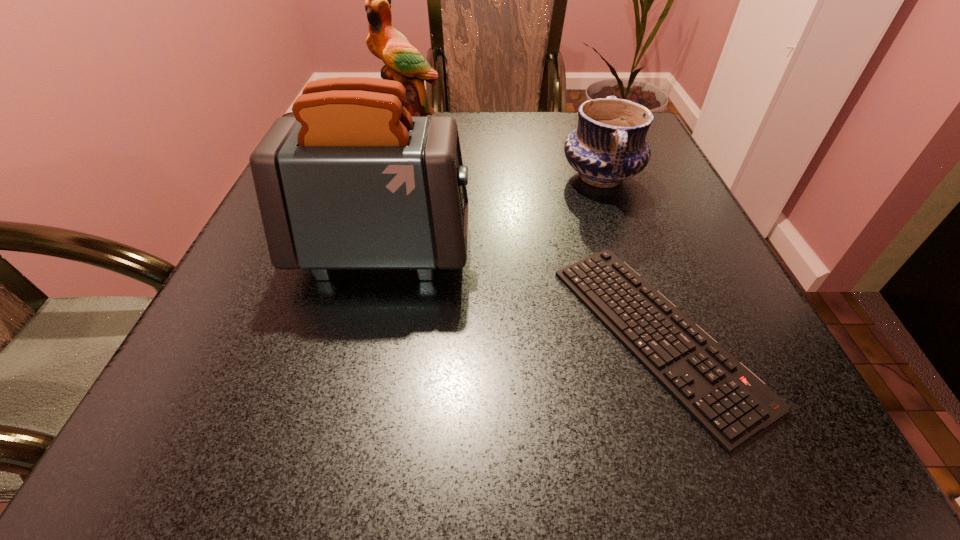
The width and height of the screenshot is (960, 540). Identify the location of pottery present at the far edge. (608, 146).

I want to click on object that is at the near edge, so click(731, 403).

The width and height of the screenshot is (960, 540). Find the location of `parrot that is at the left edge`. parrot that is at the left edge is located at coordinates (404, 63).

I want to click on toaster that is at the left edge, so click(352, 182).

You are a GUI agent. You are given a task and a screenshot of the screen. Output one action in this format:
    pyautogui.click(x=<x>, y=<y>)
    Task: Click on the pottery located at the right edge
    
    Given the screenshot: What is the action you would take?
    pyautogui.click(x=608, y=146)

I want to click on computer keyboard situated at the right edge, so click(731, 403).

Identify the location of object located at the far left corner. (404, 63).

The image size is (960, 540). Identify the location of object that is at the far right corner. (608, 146).

Locate an element on the screen. object that is positioned at the near right corner is located at coordinates (731, 403).

Where is `vacant area at the far edge`? vacant area at the far edge is located at coordinates (512, 119).